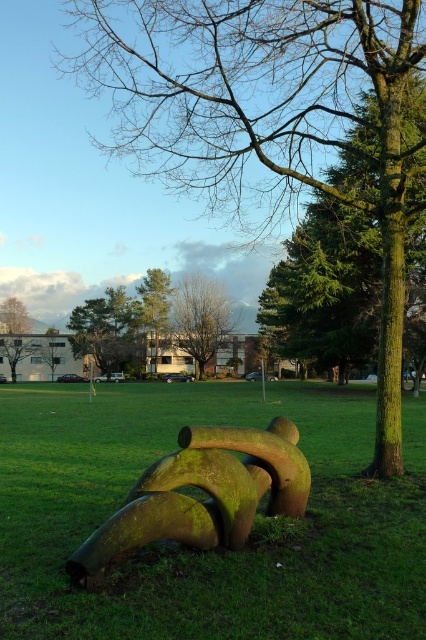
You are a park visitor who wants to take a photo of both the green mossy pipe at center and the green mossy tree at center in the same frame. The camera you have can capture objects within a 70 meter range. Will you be able to include both in a single photo?

The green mossy pipe at center is 68.39 meters from the green mossy tree at center. Since the camera can capture objects within 70 meters, both can be included in a single photo as the distance between them is less than the camera range.

You are a photographer trying to capture both the green mossy pipes at center and the green textured tree at upper center in a single frame. Which object should you position closer to the left side of your camera viewfinder to ensure both are visible?

To ensure both the green mossy pipes at center and the green textured tree at upper center are visible in your frame, you should position the green textured tree at upper center closer to the left side of your camera viewfinder since the green mossy pipes at center is on its right side.